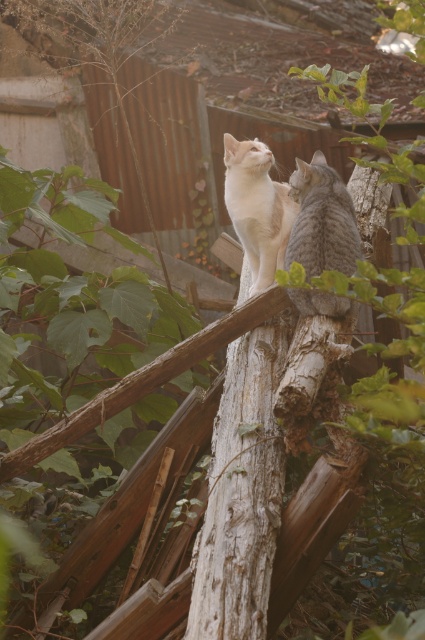
You are a cat owner trying to locate your two pets in the image. You remember that one is a gray striped cat at upper right and the other is on the gray rough wood at center. Based on their positions, which cat is closer to the left side of the image?

The gray rough wood at center is to the left of the gray striped cat at upper right, so the cat on the gray rough wood at center is closer to the left side of the image.

You are a cat owner trying to decide which cat to approach first. The gray striped cat at upper right and the white fur cat at center are both on the wooden beam. Which cat is more slender?

The gray striped cat at upper right is thinner than the white fur cat at center, so it is more slender.